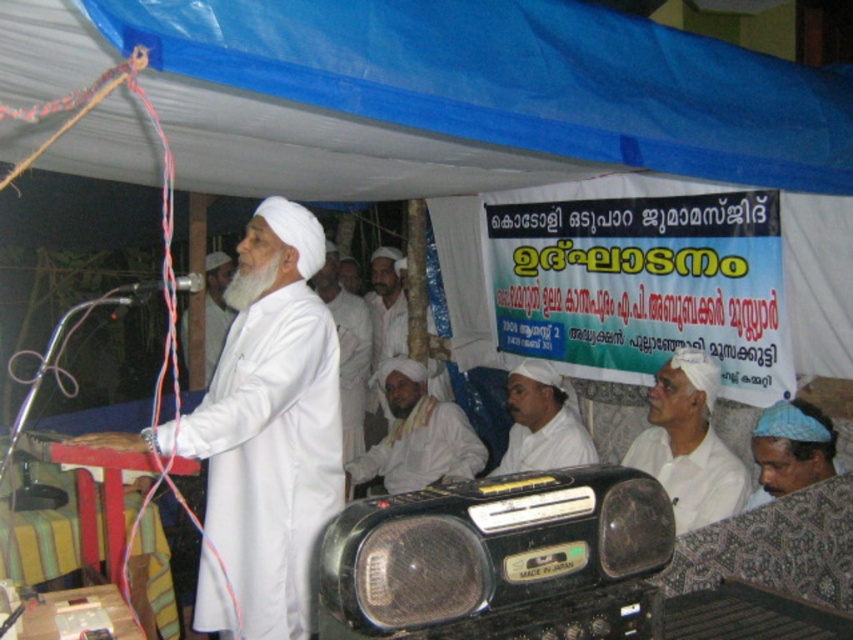
You are organizing a small event and need to place the black plastic radio at center and the white matte turban at center on a shelf. The shelf has limited space. Based on the image, which object should you place first to ensure both fit on the shelf?

The black plastic radio at center occupies less space than the white matte turban at center, so you should place the white matte turban at center first to ensure both fit on the shelf.